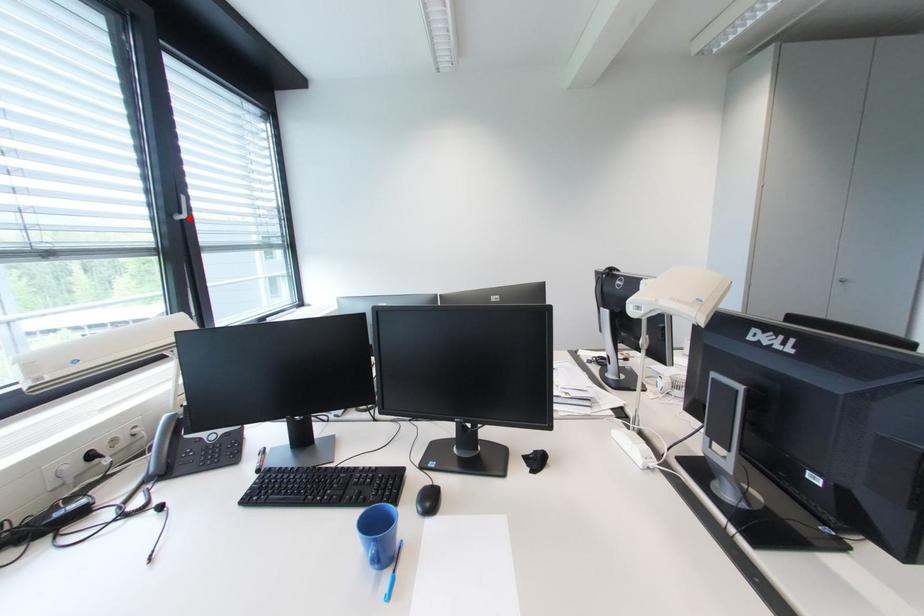
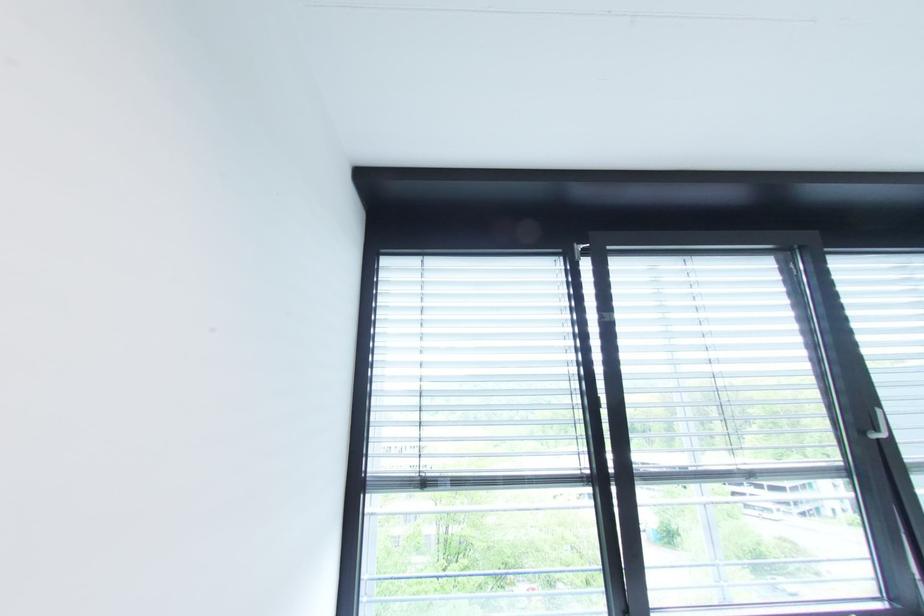
Question: I am providing you with two images of the same scene from different viewpoints. Given a red point in image1, look at the same physical point in image2. Is it:

Choices:
 (A) Closer to the viewpoint
 (B) Farther from the viewpoint

Answer: (A)